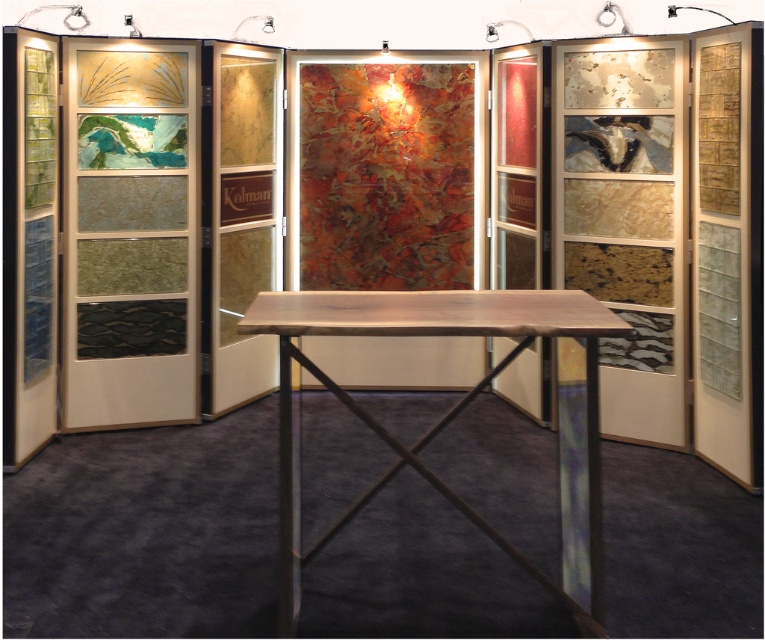
Measure the distance between point (64, 72) and camera.

Point (64, 72) and camera are 4.07 meters apart.

Is point (148, 332) less distant than point (588, 333)?

No.

Between point (63, 406) and point (597, 604), which one is positioned in front?

Point (597, 604) is in front.

In order to click on translucent glass at left in this screenshot , I will do `click(129, 234)`.